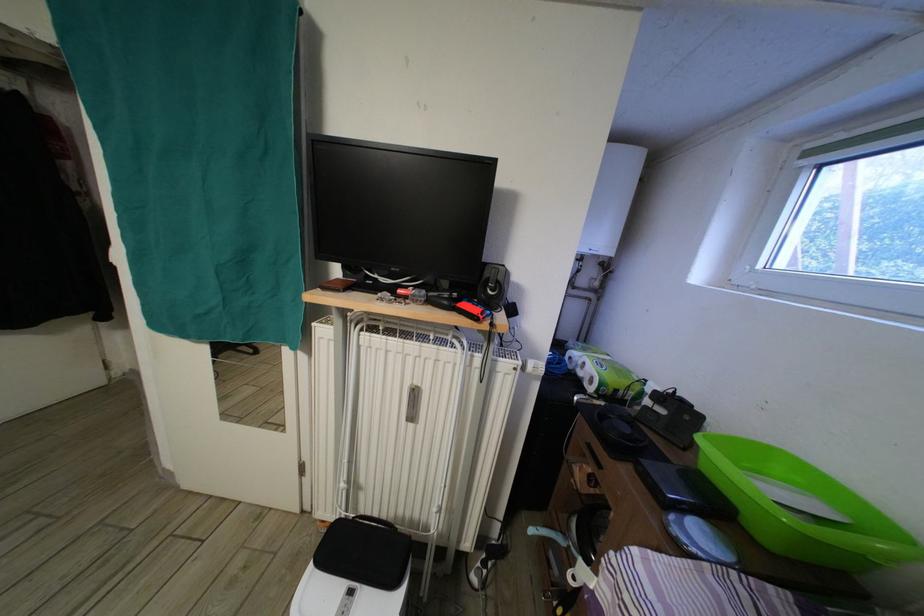
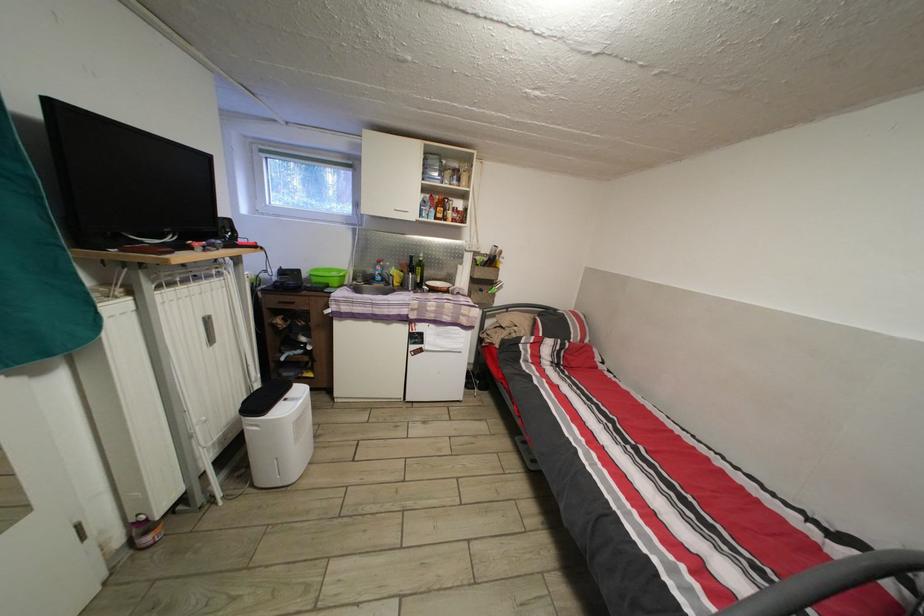
The point at (x=419, y=352) is marked in the first image. Where is the corresponding point in the second image?

(201, 294)